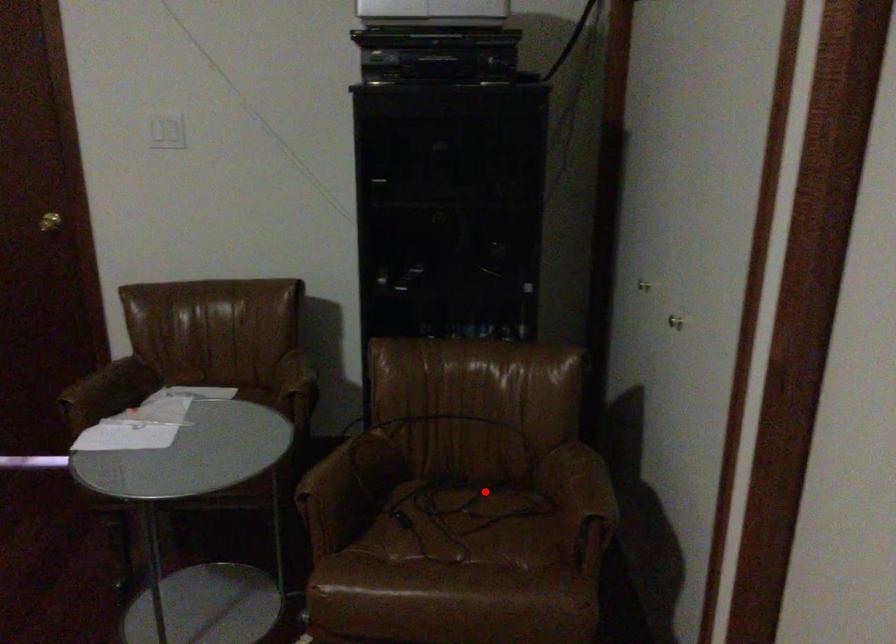
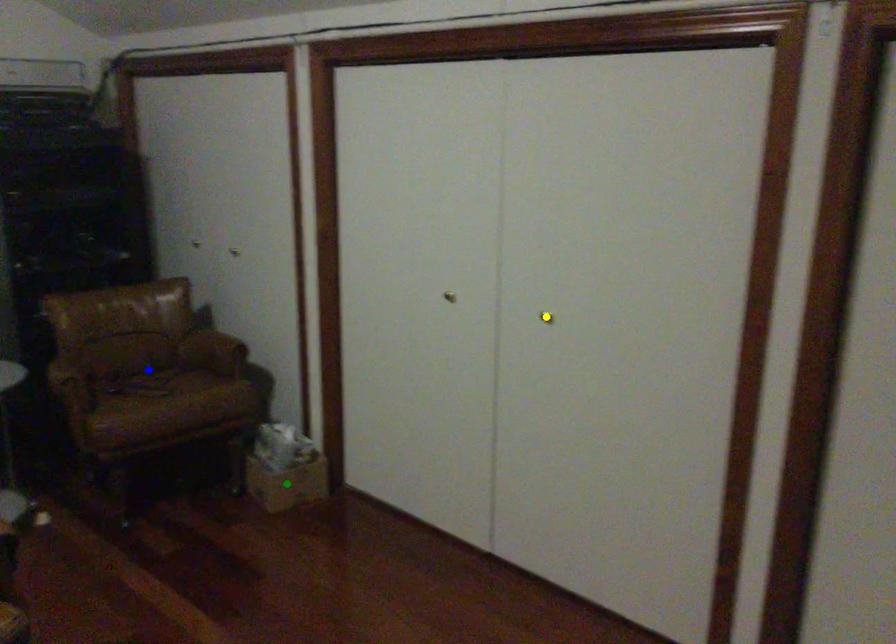
Question: I am providing you with two images of the same scene from different viewpoints. A red point is marked on the first image. You are given multiple points on the second image. Which mark in image 2 goes with the point in image 1?

Choices:
 (A) green point
 (B) yellow point
 (C) blue point

Answer: (C)